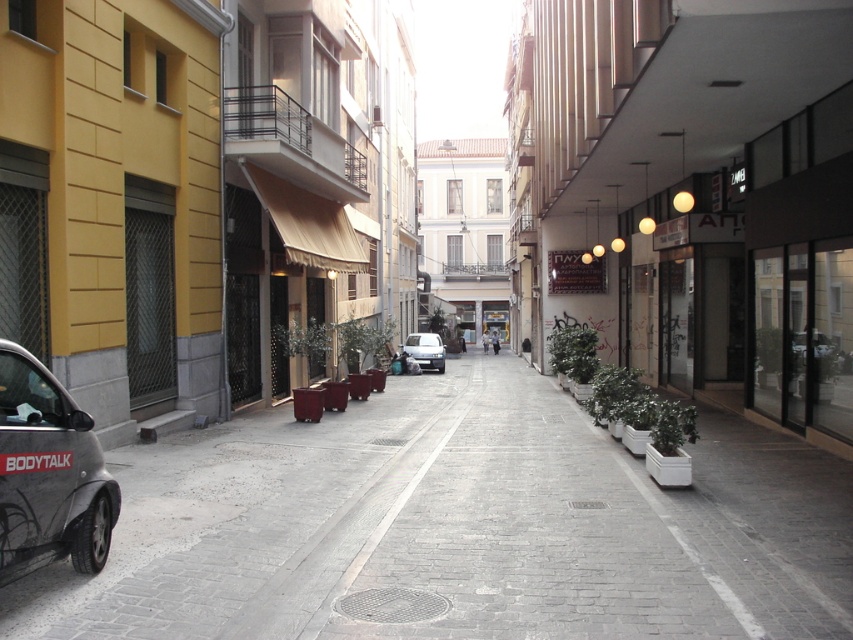
Image resolution: width=853 pixels, height=640 pixels. I want to click on gray concrete pavement at center, so click(x=457, y=525).

Where is `gray concrete pavement at center`? The width and height of the screenshot is (853, 640). gray concrete pavement at center is located at coordinates (457, 525).

Does gray concrete pavement at center have a smaller size compared to white matte van at center?

No.

Is point (144, 557) behind point (422, 342)?

That is False.

Between point (96, 584) and point (422, 348), which one is positioned behind?

The point (422, 348) is more distant.

You are a GUI agent. You are given a task and a screenshot of the screen. Output one action in this format:
    pyautogui.click(x=<x>, y=<y>)
    Task: Click on the gray concrete pavement at center
    
    Given the screenshot: What is the action you would take?
    click(457, 525)

Does matte black car at left have a larger size compared to white matte van at center?

Incorrect, matte black car at left is not larger than white matte van at center.

Who is shorter, matte black car at left or white matte van at center?

Standing shorter between the two is white matte van at center.

Who is more forward, (44, 516) or (433, 342)?

Point (44, 516) is in front.

Locate an element on the screen. matte black car at left is located at coordinates (48, 474).